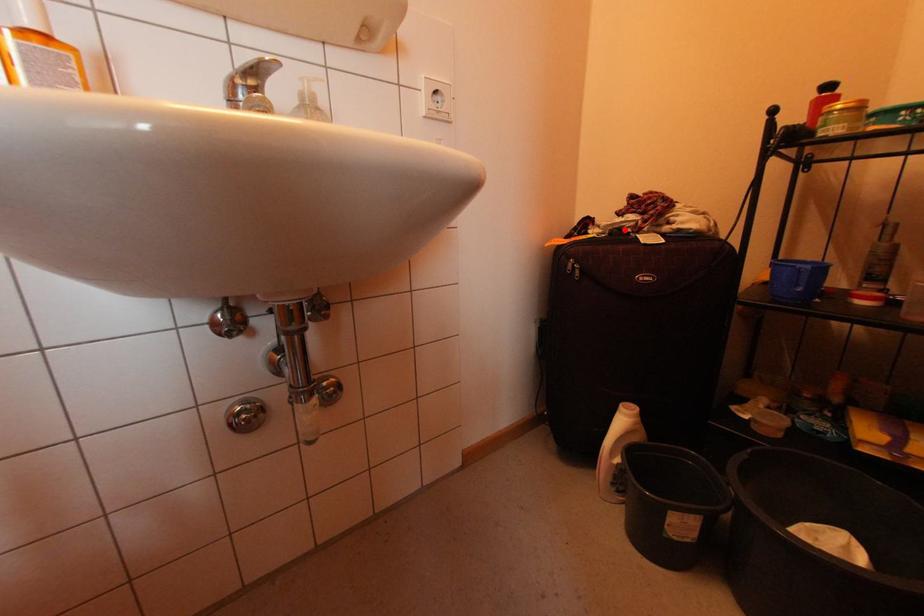
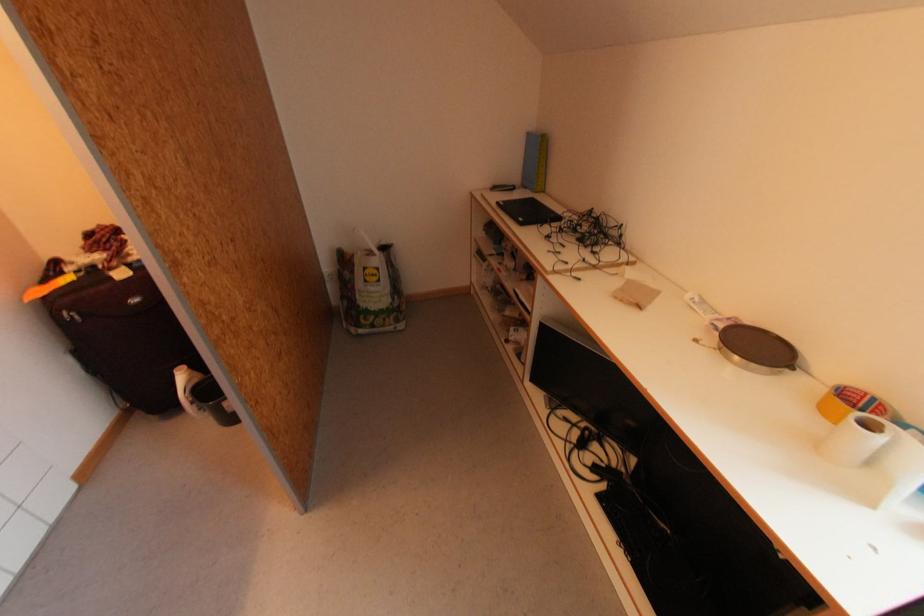
Question: I am providing you with two images of the same scene from different viewpoints. A red point is marked on the first image. At the location where the point appears in image 1, is it still visible in image 2?

Choices:
 (A) Yes
 (B) No

Answer: (A)